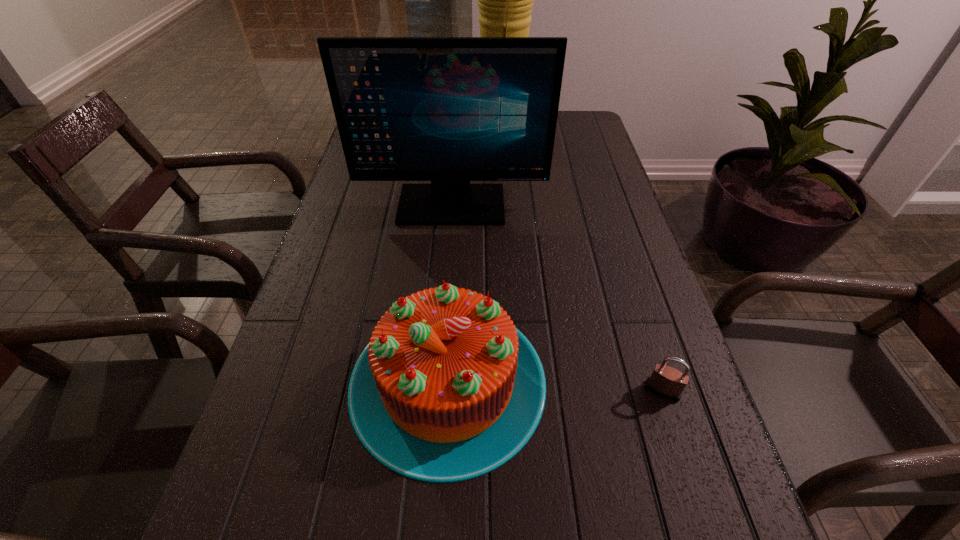
Find the location of a particular element. The height and width of the screenshot is (540, 960). vacant space that satisfies the following two spatial constraints: 1. at the front of the farthest object with handles; 2. on the screen side of the second farthest object is located at coordinates (x=506, y=205).

Find the location of a particular element. This screenshot has width=960, height=540. vacant region that satisfies the following two spatial constraints: 1. on the screen side of the cake; 2. on the right side of the third shortest object is located at coordinates (439, 381).